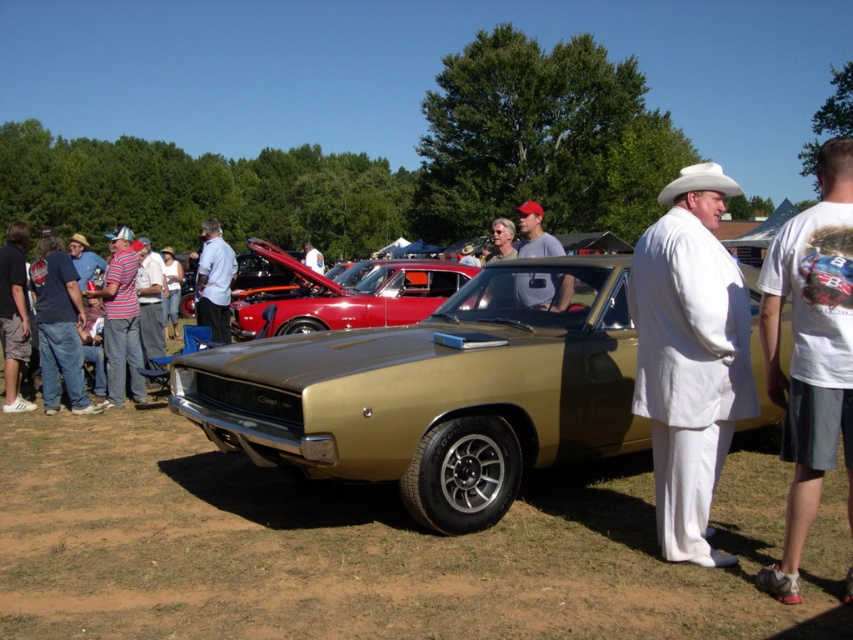
Question: Which of the following is the farthest from the observer?

Choices:
 (A) matte gray shirt at center
 (B) gold metallic car at center

Answer: (B)

Question: Is the position of white cotton suit at center more distant than that of white cotton t-shirt at center?

Choices:
 (A) yes
 (B) no

Answer: (A)

Question: Is gold metallic muscle car at center thinner than gold metallic car at center?

Choices:
 (A) yes
 (B) no

Answer: (B)

Question: Which of these objects is positioned farthest from the matte gray shirt at center?

Choices:
 (A) light blue shirt at center
 (B) white cotton t-shirt at center

Answer: (A)

Question: Does white cotton suit at center have a smaller size compared to matte gray shirt at center?

Choices:
 (A) yes
 (B) no

Answer: (A)

Question: Which point is farther to the camera?

Choices:
 (A) (714, 195)
 (B) (473, 296)

Answer: (B)